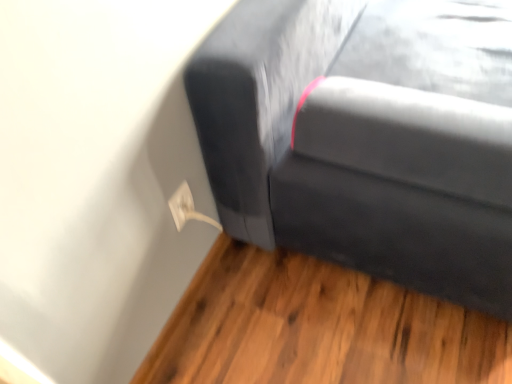
The width and height of the screenshot is (512, 384). Find the location of `matte black couch at upper right`. matte black couch at upper right is located at coordinates (366, 137).

What do you see at coordinates (366, 137) in the screenshot? The height and width of the screenshot is (384, 512). I see `matte black couch at upper right` at bounding box center [366, 137].

Measure the distance between point (264, 83) and camera.

They are 37.72 inches apart.

Describe the element at coordinates (182, 205) in the screenshot. I see `white plastic electric outlet at lower left` at that location.

The width and height of the screenshot is (512, 384). Find the location of `white plastic electric outlet at lower left`. white plastic electric outlet at lower left is located at coordinates (182, 205).

In order to face white plastic electric outlet at lower left, should I rotate leftwards or rightwards?

Rotate left and turn 9.386 degrees.

In order to click on matte black couch at upper right in this screenshot , I will do `click(366, 137)`.

Considering the relative positions of white plastic electric outlet at lower left and matte black couch at upper right in the image provided, is white plastic electric outlet at lower left to the left of matte black couch at upper right from the viewer's perspective?

Indeed, white plastic electric outlet at lower left is positioned on the left side of matte black couch at upper right.

Is the position of white plastic electric outlet at lower left less distant than that of matte black couch at upper right?

No, the depth of white plastic electric outlet at lower left is greater than that of matte black couch at upper right.

Which is nearer, (179,217) or (419,290)?

Point (179,217) appears to be closer to the viewer than point (419,290).

From the image's perspective, would you say white plastic electric outlet at lower left is shown under matte black couch at upper right?

No, from the image's perspective, white plastic electric outlet at lower left is not beneath matte black couch at upper right.

From a real-world perspective, which object rests below the other?

In real-world perspective, matte black couch at upper right is lower.

Which of these two, white plastic electric outlet at lower left or matte black couch at upper right, is thinner?

white plastic electric outlet at lower left.

Considering the relative sizes of white plastic electric outlet at lower left and matte black couch at upper right in the image provided, is white plastic electric outlet at lower left shorter than matte black couch at upper right?

No.

Looking at this image, in terms of size, does white plastic electric outlet at lower left appear bigger or smaller than matte black couch at upper right?

In the image, white plastic electric outlet at lower left appears to be smaller than matte black couch at upper right.

Is white plastic electric outlet at lower left completely or partially outside of matte black couch at upper right?

Yes, white plastic electric outlet at lower left is located beyond the bounds of matte black couch at upper right.

Is white plastic electric outlet at lower left far from matte black couch at upper right?

white plastic electric outlet at lower left is near matte black couch at upper right, not far away.

Is white plastic electric outlet at lower left oriented away from matte black couch at upper right?

No.

How different are the orientations of white plastic electric outlet at lower left and matte black couch at upper right in degrees?

white plastic electric outlet at lower left and matte black couch at upper right are facing 180 degrees away from each other.

From the picture: Measure the distance between white plastic electric outlet at lower left and matte black couch at upper right.

They are 15.90 inches apart.

Identify the location of electric outlet above the matte black couch at upper right (from a real-world perspective). (182, 205).

Between matte black couch at upper right and white plastic electric outlet at lower left, which one appears on the left side from the viewer's perspective?

white plastic electric outlet at lower left is more to the left.

Is matte black couch at upper right positioned before white plastic electric outlet at lower left?

Yes, the depth of matte black couch at upper right is less than that of white plastic electric outlet at lower left.

Does point (271, 56) come closer to viewer compared to point (176, 218)?

That is True.

From the image's perspective, is matte black couch at upper right over white plastic electric outlet at lower left?

Actually, matte black couch at upper right appears below white plastic electric outlet at lower left in the image.

From a real-world perspective, between matte black couch at upper right and white plastic electric outlet at lower left, who is vertically higher?

white plastic electric outlet at lower left, from a real-world perspective.

Between matte black couch at upper right and white plastic electric outlet at lower left, which one has larger width?

Wider between the two is matte black couch at upper right.

Does matte black couch at upper right have a greater height compared to white plastic electric outlet at lower left?

No, matte black couch at upper right is not taller than white plastic electric outlet at lower left.

Can you confirm if matte black couch at upper right is smaller than white plastic electric outlet at lower left?

No, matte black couch at upper right is not smaller than white plastic electric outlet at lower left.

Looking at this image, is white plastic electric outlet at lower left a part of matte black couch at upper right?

No, white plastic electric outlet at lower left is not inside matte black couch at upper right.

Is matte black couch at upper right not near white plastic electric outlet at lower left?

matte black couch at upper right is near white plastic electric outlet at lower left, not far away.

Is matte black couch at upper right looking in the opposite direction of white plastic electric outlet at lower left?

matte black couch at upper right is not turned away from white plastic electric outlet at lower left.

Consider the image. Can you tell me how much matte black couch at upper right and white plastic electric outlet at lower left differ in facing direction?

180 degrees.

Find the location of a particular element. The width and height of the screenshot is (512, 384). studio couch lying below the white plastic electric outlet at lower left (from the image's perspective) is located at coordinates (366, 137).

The width and height of the screenshot is (512, 384). Identify the location of electric outlet behind the matte black couch at upper right. (182, 205).

I want to click on studio couch located below the white plastic electric outlet at lower left (from the image's perspective), so click(366, 137).